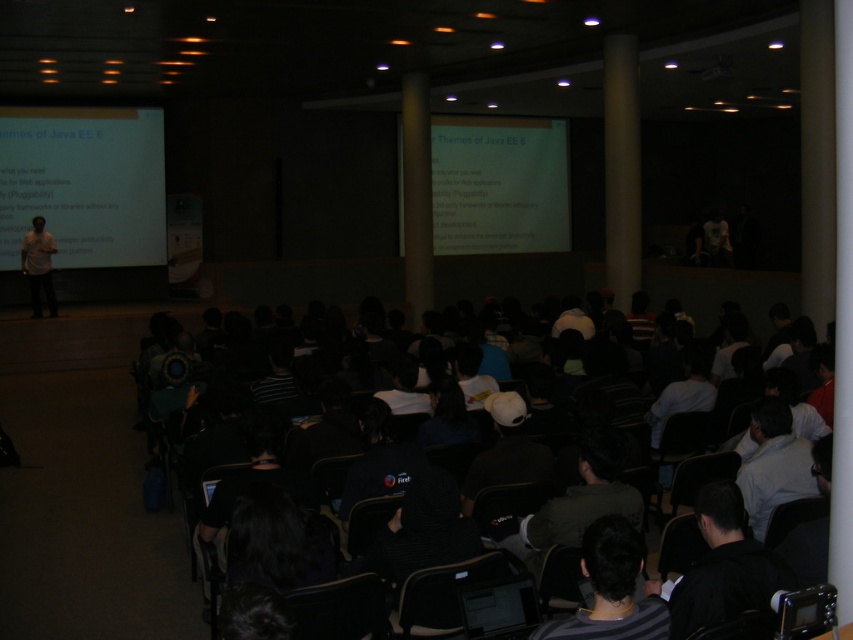
Question: Can you confirm if black fabric shirt at center is positioned above dark gray striped shirt at lower center?

Choices:
 (A) no
 (B) yes

Answer: (A)

Question: Which point is farther to the camera?

Choices:
 (A) (45, 268)
 (B) (635, 605)

Answer: (A)

Question: Is black fabric shirt at lower right wider than light brown shirt at left?

Choices:
 (A) no
 (B) yes

Answer: (A)

Question: Which of these objects is positioned farthest from the white shirt at center?

Choices:
 (A) black fabric shirt at lower right
 (B) white matte projector screen at upper left
 (C) light brown shirt at left

Answer: (B)

Question: Is black fabric shirt at center behind light brown shirt at left?

Choices:
 (A) yes
 (B) no

Answer: (B)

Question: Among these objects, which one is nearest to the camera?

Choices:
 (A) white shirt at center
 (B) dark gray striped shirt at lower center
 (C) black fabric shirt at lower right
 (D) black fabric shirt at center

Answer: (B)